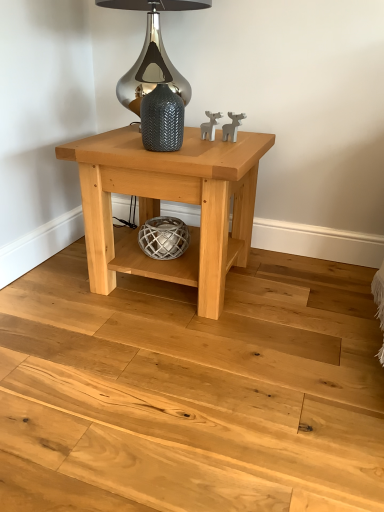
What are the coordinates of `blank space situated above natural wood table at center (from a real-world perspective)` in the screenshot? It's located at (178, 151).